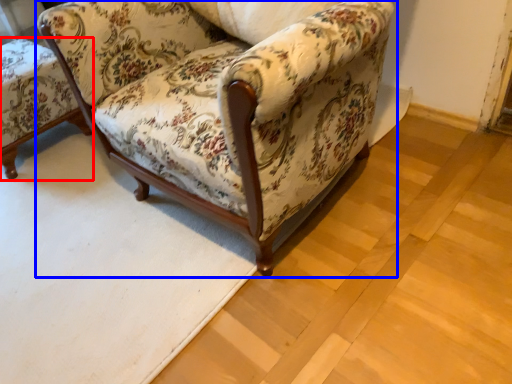
Question: Which of the following is the closest to the observer, chair (highlighted by a red box) or chair (highlighted by a blue box)?

Choices:
 (A) chair
 (B) chair

Answer: (B)